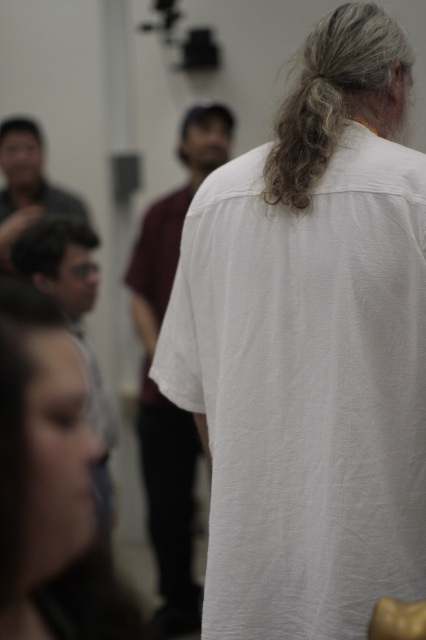
Question: Which point is closer to the camera?

Choices:
 (A) (178, 452)
 (B) (17, 120)
 (C) (129, 628)
 (D) (316, 173)

Answer: (C)

Question: Estimate the real-world distances between objects in this image. Which object is farther from the matte black hair at lower left?

Choices:
 (A) dark brown hair at lower left
 (B) brown matte hair at upper left
 (C) matte gray shirt at lower left

Answer: (B)

Question: Among these objects, which one is farthest from the camera?

Choices:
 (A) matte black hair at lower left
 (B) brown matte hair at upper left

Answer: (B)

Question: Does curly blonde hair at upper center come in front of matte black shirt at upper left?

Choices:
 (A) yes
 (B) no

Answer: (A)

Question: Is white cotton shirt at center to the left of dark brown hair at lower left from the viewer's perspective?

Choices:
 (A) no
 (B) yes

Answer: (A)

Question: Is matte gray shirt at lower left above brown matte hair at upper left?

Choices:
 (A) yes
 (B) no

Answer: (B)